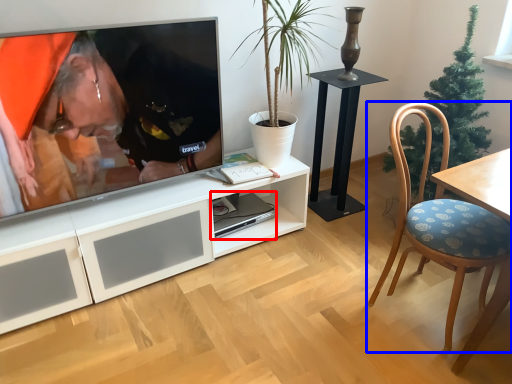
Question: Which object is closer to the camera taking this photo, computer (highlighted by a red box) or chair (highlighted by a blue box)?

Choices:
 (A) computer
 (B) chair

Answer: (B)